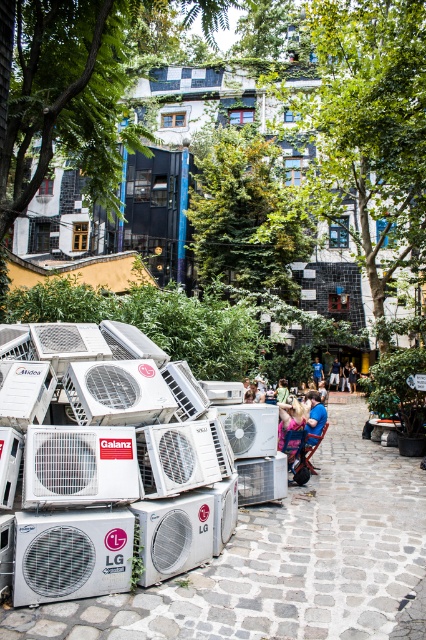
Which is behind, point (218, 193) or point (31, 442)?

The point (218, 193) is behind.

Is green leafy tree at center to the left of white metallic air conditioner at center from the viewer's perspective?

No, green leafy tree at center is not to the left of white metallic air conditioner at center.

Who is more distant from viewer, [310,250] or [74,500]?

Point [310,250]

Where is `green leafy tree at center`? The height and width of the screenshot is (640, 426). green leafy tree at center is located at coordinates (244, 212).

Does green leafy tree at center lie in front of light brown leather jacket at center?

No, it is behind light brown leather jacket at center.

Between point (267, 288) and point (282, 401), which one is positioned in front?

Point (282, 401) is in front.

Image resolution: width=426 pixels, height=640 pixels. In order to click on green leafy tree at center in this screenshot , I will do `click(244, 212)`.

Who is positioned more to the right, green leafy tree at upper center or silver metallic lg air conditioner at lower left?

Positioned to the right is green leafy tree at upper center.

Can you confirm if green leafy tree at upper center is wider than silver metallic lg air conditioner at lower left?

Indeed, green leafy tree at upper center has a greater width compared to silver metallic lg air conditioner at lower left.

Who is more distant from viewer, (339, 243) or (85, 518)?

The point (339, 243) is more distant.

The width and height of the screenshot is (426, 640). What are the coordinates of `green leafy tree at upper center` in the screenshot? It's located at (368, 132).